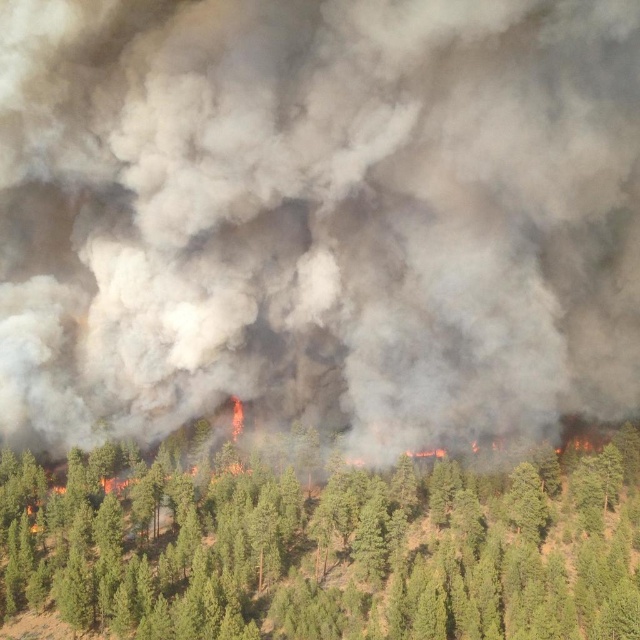
Question: Among these objects, which one is nearest to the camera?

Choices:
 (A) gray matte smoke at center
 (B) green leafy tree at center

Answer: (B)

Question: Which point appears closest to the camera in this image?

Choices:
 (A) (260, 216)
 (B) (358, 541)

Answer: (B)

Question: Which of the following is the farthest from the observer?

Choices:
 (A) gray matte smoke at center
 (B) green leafy tree at center

Answer: (A)

Question: Is gray matte smoke at center bigger than green leafy tree at center?

Choices:
 (A) no
 (B) yes

Answer: (B)

Question: Is gray matte smoke at center below green leafy tree at center?

Choices:
 (A) no
 (B) yes

Answer: (A)

Question: From the image, what is the correct spatial relationship of gray matte smoke at center in relation to green leafy tree at center?

Choices:
 (A) above
 (B) below

Answer: (A)